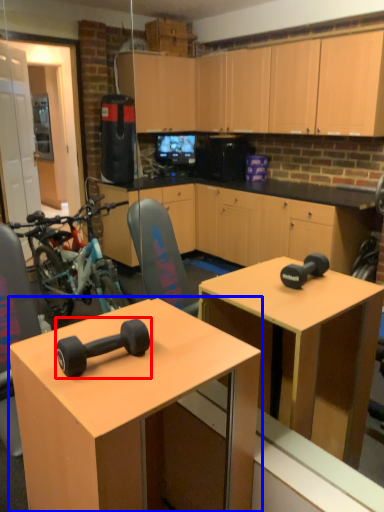
Question: Which object appears closest to the camera in this image, dumbbell (highlighted by a red box) or desk (highlighted by a blue box)?

Choices:
 (A) dumbbell
 (B) desk

Answer: (B)